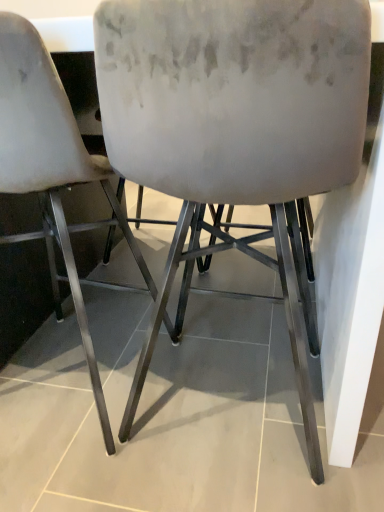
This screenshot has height=512, width=384. Identify the location of velvet beige chair at center, which appears as the first chair when viewed from the right. (235, 131).

The width and height of the screenshot is (384, 512). Describe the element at coordinates (235, 131) in the screenshot. I see `velvet beige chair at center, which appears as the first chair when viewed from the right` at that location.

Based on the photo, how much space does velvet beige chair at center, which appears as the first chair when viewed from the right, occupy vertically?

The height of velvet beige chair at center, which appears as the first chair when viewed from the right, is 37.06 inches.

What do you see at coordinates (52, 167) in the screenshot? I see `satin white chair at center, which appears as the 1th chair when viewed from the left` at bounding box center [52, 167].

At what (x,y) coordinates should I click in order to perform the action: click on satin white chair at center, placed as the 2th chair when sorted from right to left. Please return your answer as a coordinate pair (x, y). The width and height of the screenshot is (384, 512). Looking at the image, I should click on (52, 167).

Locate an element on the screen. The height and width of the screenshot is (512, 384). velvet beige chair at center, which appears as the first chair when viewed from the right is located at coordinates (235, 131).

Based on their positions, is velvet beige chair at center, the second chair viewed from the left, located to the left or right of satin white chair at center, placed as the 2th chair when sorted from right to left?

Clearly, velvet beige chair at center, the second chair viewed from the left, is on the right of satin white chair at center, placed as the 2th chair when sorted from right to left, in the image.

Which is behind, velvet beige chair at center, the second chair viewed from the left, or satin white chair at center, which appears as the 1th chair when viewed from the left?

satin white chair at center, which appears as the 1th chair when viewed from the left, is behind.

Considering the points (248, 174) and (16, 96), which point is in front, point (248, 174) or point (16, 96)?

The point (248, 174) is closer to the camera.

From the image's perspective, which is above, velvet beige chair at center, which appears as the first chair when viewed from the right, or satin white chair at center, which appears as the 1th chair when viewed from the left?

satin white chair at center, which appears as the 1th chair when viewed from the left.

From a real-world perspective, between velvet beige chair at center, the second chair viewed from the left, and satin white chair at center, placed as the 2th chair when sorted from right to left, who is vertically higher?

In real-world perspective, satin white chair at center, placed as the 2th chair when sorted from right to left, is above.

From the picture: Which object is wider, velvet beige chair at center, the second chair viewed from the left, or satin white chair at center, placed as the 2th chair when sorted from right to left?

With larger width is velvet beige chair at center, the second chair viewed from the left.

In terms of height, does velvet beige chair at center, the second chair viewed from the left, look taller or shorter compared to satin white chair at center, placed as the 2th chair when sorted from right to left?

Considering their sizes, velvet beige chair at center, the second chair viewed from the left, has more height than satin white chair at center, placed as the 2th chair when sorted from right to left.

Between velvet beige chair at center, the second chair viewed from the left, and satin white chair at center, which appears as the 1th chair when viewed from the left, which one has larger size?

With larger size is velvet beige chair at center, the second chair viewed from the left.

Does velvet beige chair at center, which appears as the first chair when viewed from the right, contain satin white chair at center, placed as the 2th chair when sorted from right to left?

No, satin white chair at center, placed as the 2th chair when sorted from right to left, is located outside of velvet beige chair at center, which appears as the first chair when viewed from the right.

Is velvet beige chair at center, the second chair viewed from the left, in contact with satin white chair at center, placed as the 2th chair when sorted from right to left?

They are not placed beside each other.

Does velvet beige chair at center, the second chair viewed from the left, turn towards satin white chair at center, placed as the 2th chair when sorted from right to left?

No.

In the scene shown: What's the angular difference between velvet beige chair at center, the second chair viewed from the left, and satin white chair at center, which appears as the 1th chair when viewed from the left,'s facing directions?

There is a 1.76-degree angle between the facing directions of velvet beige chair at center, the second chair viewed from the left, and satin white chair at center, which appears as the 1th chair when viewed from the left.

This screenshot has height=512, width=384. In order to click on chair below the satin white chair at center, placed as the 2th chair when sorted from right to left (from the image's perspective) in this screenshot , I will do `click(235, 131)`.

Can you confirm if satin white chair at center, which appears as the 1th chair when viewed from the left, is positioned to the left of velvet beige chair at center, the second chair viewed from the left?

Indeed, satin white chair at center, which appears as the 1th chair when viewed from the left, is positioned on the left side of velvet beige chair at center, the second chair viewed from the left.

Is the depth of satin white chair at center, placed as the 2th chair when sorted from right to left, less than that of velvet beige chair at center, the second chair viewed from the left?

No.

Which point is more forward, (35, 31) or (306, 192)?

The point (35, 31) is closer.

From the image's perspective, relative to velvet beige chair at center, which appears as the first chair when viewed from the right, is satin white chair at center, which appears as the 1th chair when viewed from the left, above or below?

satin white chair at center, which appears as the 1th chair when viewed from the left, is above velvet beige chair at center, which appears as the first chair when viewed from the right.

From a real-world perspective, who is located higher, satin white chair at center, placed as the 2th chair when sorted from right to left, or velvet beige chair at center, which appears as the first chair when viewed from the right?

satin white chair at center, placed as the 2th chair when sorted from right to left, from a real-world perspective.

Is satin white chair at center, which appears as the 1th chair when viewed from the left, thinner than velvet beige chair at center, the second chair viewed from the left?

Correct, the width of satin white chair at center, which appears as the 1th chair when viewed from the left, is less than that of velvet beige chair at center, the second chair viewed from the left.

Which of these two, satin white chair at center, placed as the 2th chair when sorted from right to left, or velvet beige chair at center, which appears as the first chair when viewed from the right, stands taller?

Standing taller between the two is velvet beige chair at center, which appears as the first chair when viewed from the right.

Considering the sizes of objects satin white chair at center, placed as the 2th chair when sorted from right to left, and velvet beige chair at center, the second chair viewed from the left, in the image provided, who is bigger, satin white chair at center, placed as the 2th chair when sorted from right to left, or velvet beige chair at center, the second chair viewed from the left,?

velvet beige chair at center, the second chair viewed from the left, is bigger.

Is velvet beige chair at center, which appears as the first chair when viewed from the right, surrounded by satin white chair at center, which appears as the 1th chair when viewed from the left?

No.

Are satin white chair at center, which appears as the 1th chair when viewed from the left, and velvet beige chair at center, the second chair viewed from the left, beside each other?

No, satin white chair at center, which appears as the 1th chair when viewed from the left, is not making contact with velvet beige chair at center, the second chair viewed from the left.

Is satin white chair at center, placed as the 2th chair when sorted from right to left, aimed at velvet beige chair at center, which appears as the first chair when viewed from the right?

No, satin white chair at center, placed as the 2th chair when sorted from right to left, is not turned towards velvet beige chair at center, which appears as the first chair when viewed from the right.

Measure the distance between satin white chair at center, which appears as the 1th chair when viewed from the left, and velvet beige chair at center, the second chair viewed from the left.

satin white chair at center, which appears as the 1th chair when viewed from the left, is 10.61 inches from velvet beige chair at center, the second chair viewed from the left.

Find the location of a particular element. Image resolution: width=384 pixels, height=512 pixels. chair lying on the left of velvet beige chair at center, the second chair viewed from the left is located at coordinates (52, 167).

At what (x,y) coordinates should I click in order to perform the action: click on chair below the satin white chair at center, which appears as the 1th chair when viewed from the left (from a real-world perspective). Please return your answer as a coordinate pair (x, y). Looking at the image, I should click on click(x=235, y=131).

Find the location of a particular element. chair lying behind the velvet beige chair at center, which appears as the first chair when viewed from the right is located at coordinates (52, 167).